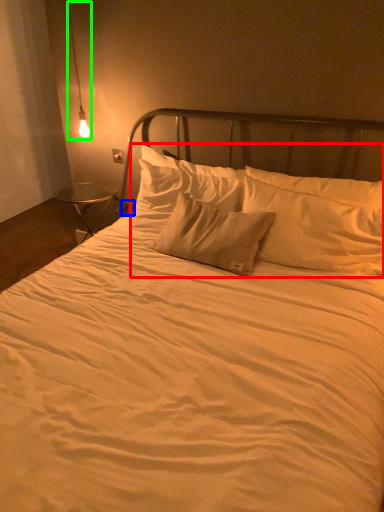
Question: Which is farther away from pillow (highlighted by a red box)? electric outlet (highlighted by a blue box) or lamp (highlighted by a green box)?

Choices:
 (A) electric outlet
 (B) lamp

Answer: (B)